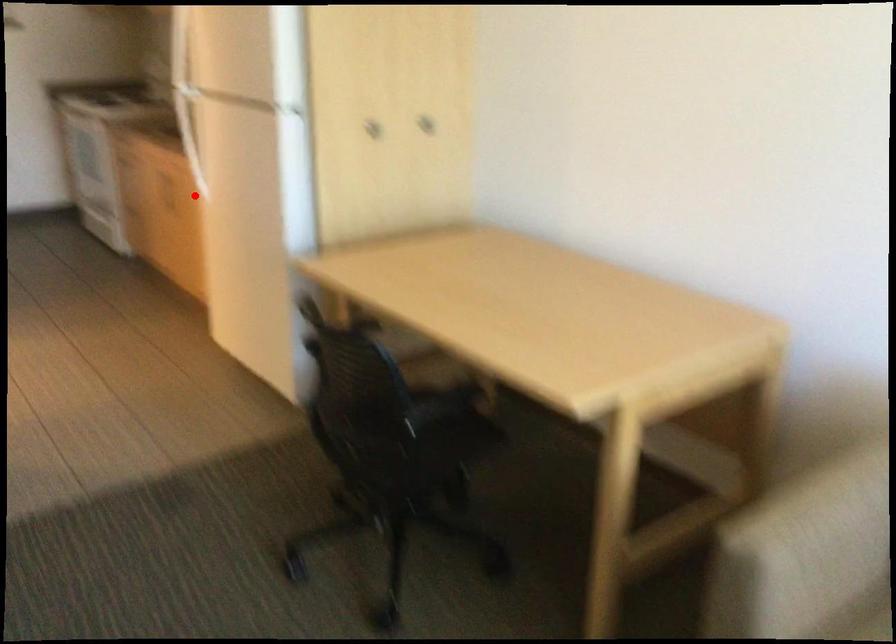
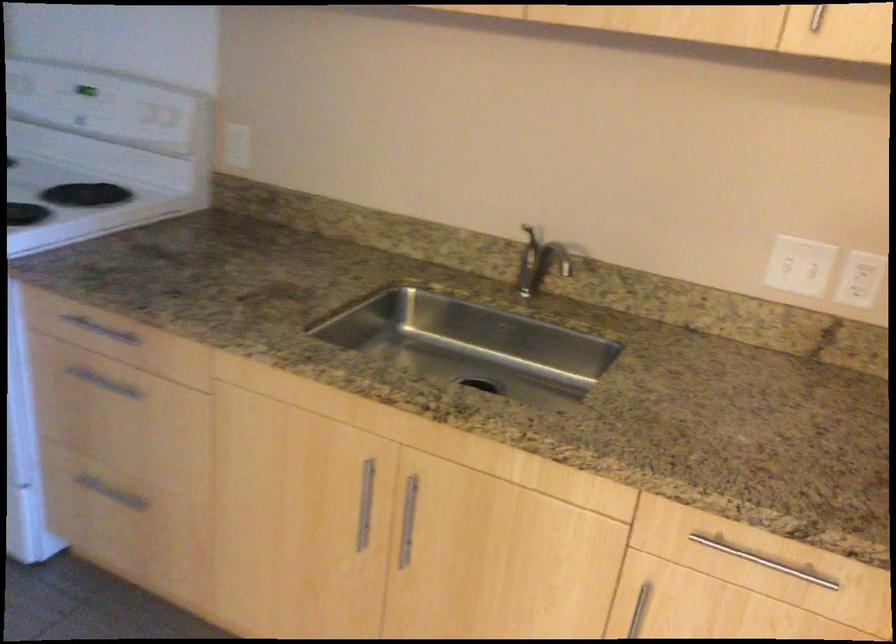
Question: I am providing you with two images of the same scene from different viewpoints. Given a red point in image1, look at the same physical point in image2. Is it:

Choices:
 (A) Closer to the viewpoint
 (B) Farther from the viewpoint

Answer: (A)